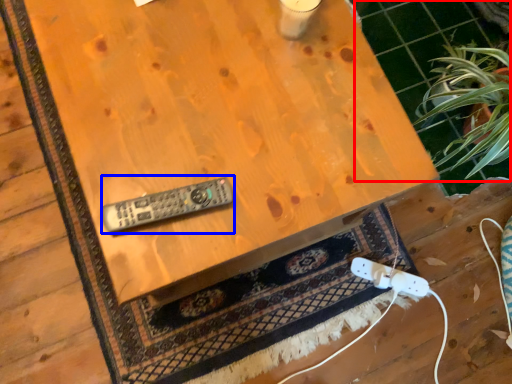
Question: Which object is further to the camera taking this photo, tile (highlighted by a red box) or control (highlighted by a blue box)?

Choices:
 (A) tile
 (B) control

Answer: (A)